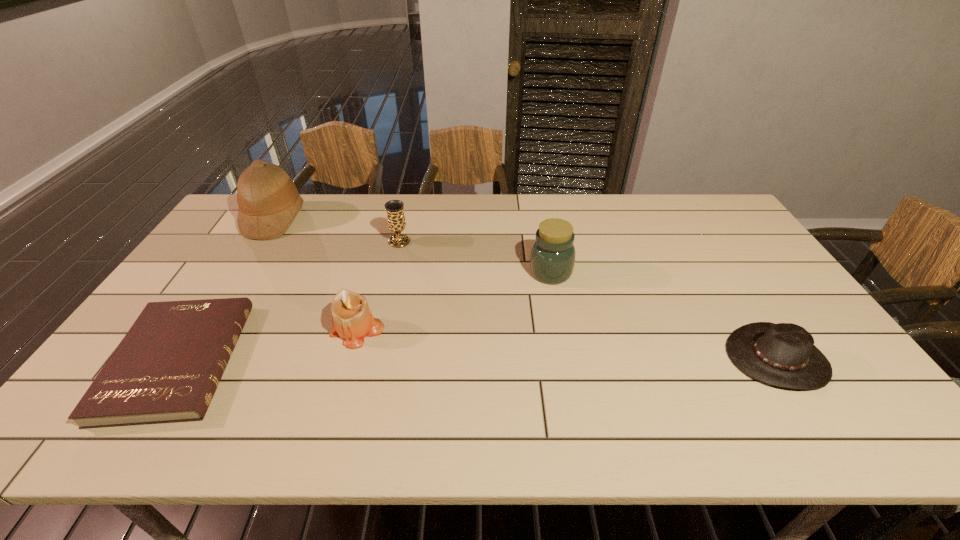
This screenshot has height=540, width=960. In order to click on vacant space in between the fifth object from left to right and the chalice in this screenshot , I will do `click(475, 257)`.

At what (x,y) coordinates should I click in order to perform the action: click on empty space between the candle and the hardback book. Please return your answer as a coordinate pair (x, y). The width and height of the screenshot is (960, 540). Looking at the image, I should click on (267, 346).

You are a GUI agent. You are given a task and a screenshot of the screen. Output one action in this format:
    pyautogui.click(x=<x>, y=<y>)
    Task: Click on the empty location between the left hat and the shortest object
    The height and width of the screenshot is (540, 960).
    Given the screenshot: What is the action you would take?
    pyautogui.click(x=227, y=290)

Where is `vacant area between the fifth object from left to right and the chalice`? Image resolution: width=960 pixels, height=540 pixels. vacant area between the fifth object from left to right and the chalice is located at coordinates (475, 257).

This screenshot has width=960, height=540. I want to click on free space between the rightmost object and the left hat, so click(526, 288).

At what (x,y) coordinates should I click in order to perform the action: click on unoccupied area between the candle and the chalice. Please return your answer as a coordinate pair (x, y). Image resolution: width=960 pixels, height=540 pixels. Looking at the image, I should click on (378, 286).

The height and width of the screenshot is (540, 960). I want to click on free space between the taller hat and the hardback book, so click(x=227, y=290).

Select which object is the closest to the chalice. Please provide its 2D coordinates. Your answer should be formatted as a tuple, i.e. [(x, y)], where the tuple contains the x and y coordinates of a point satisfying the conditions above.

[(351, 316)]

This screenshot has height=540, width=960. Identify the location of object that is the fourth closest to the tallest object. (552, 259).

Locate an element on the screen. vacant region that satisfies the following two spatial constraints: 1. on the front-facing side of the taller hat; 2. on the right side of the second object from right to left is located at coordinates (240, 272).